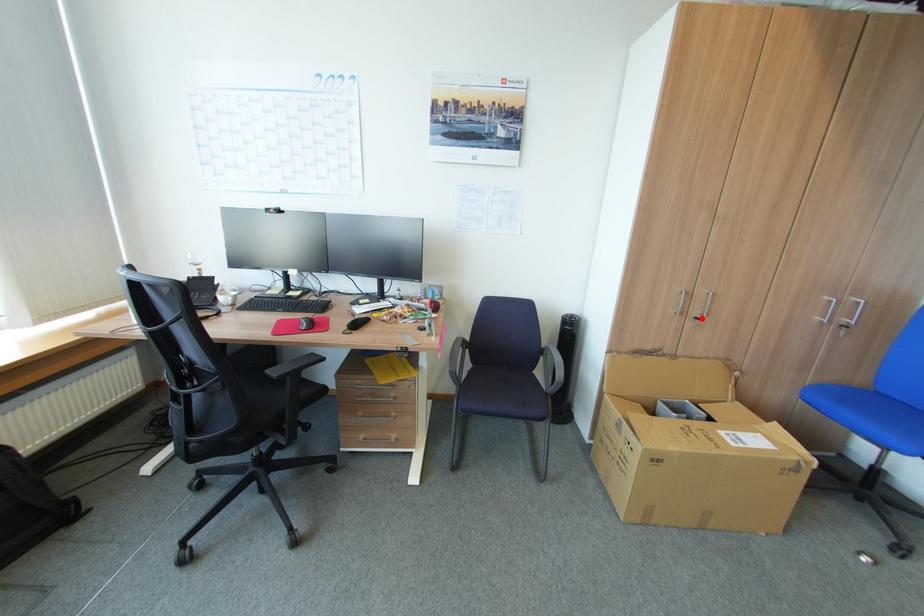
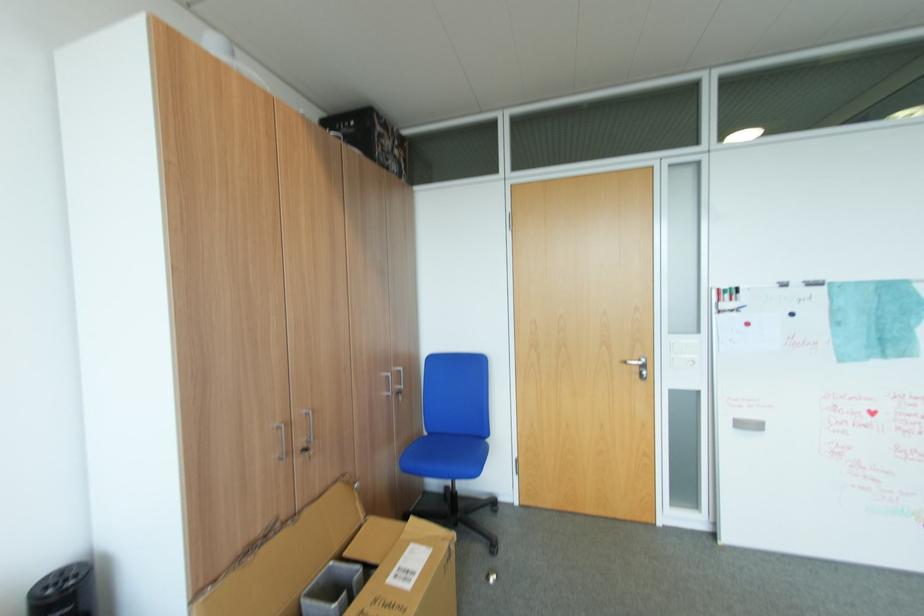
Find the pixel in the second image that matches the highlighted location in the first image.

(310, 451)